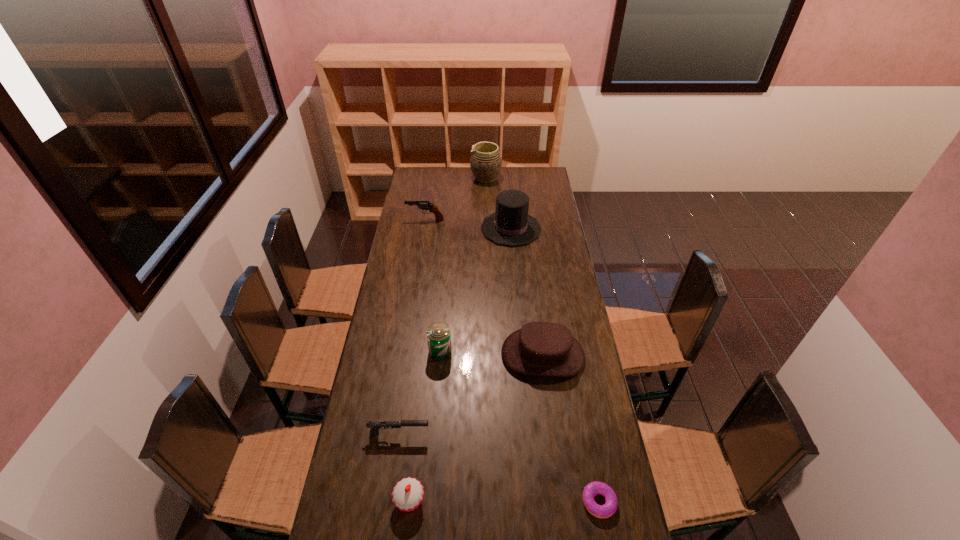
You are a GUI agent. You are given a task and a screenshot of the screen. Output one action in this format:
    pyautogui.click(x=<x>, y=<y>)
    Task: Click on the doughnut at the right edge
    
    Given the screenshot: What is the action you would take?
    pyautogui.click(x=592, y=489)

Identify the location of free space at the far edge of the desktop. (516, 179).

Identify the location of vacant space at the left edge of the desktop. The width and height of the screenshot is (960, 540). (360, 514).

Locate an element on the screen. vacant space at the right edge of the desktop is located at coordinates (557, 427).

The height and width of the screenshot is (540, 960). What are the coordinates of `empty location between the can and the sixth tallest object` in the screenshot? It's located at (425, 426).

Locate an element on the screen. free space between the farthest object and the shorter hat is located at coordinates 515,267.

At what (x,y) coordinates should I click in order to perform the action: click on empty space that is in between the can and the sixth tallest object. Please return your answer as a coordinate pair (x, y). The height and width of the screenshot is (540, 960). Looking at the image, I should click on (425, 426).

The image size is (960, 540). What are the coordinates of `free area in between the nearer hat and the nearer gun` in the screenshot? It's located at click(x=470, y=394).

I want to click on vacant space that's between the farthest object and the shorter hat, so click(x=515, y=267).

The image size is (960, 540). I want to click on vacant space that's between the farther hat and the can, so click(475, 290).